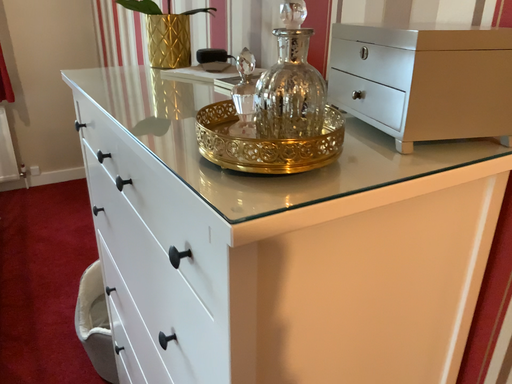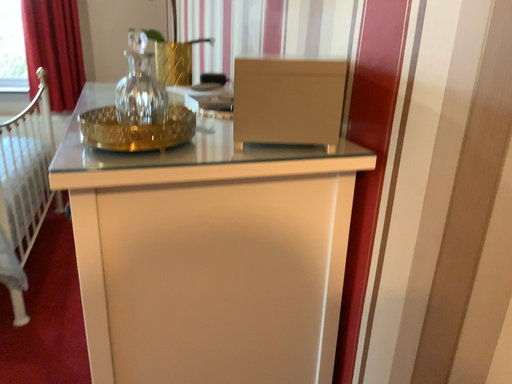
Question: Which way did the camera rotate in the video?

Choices:
 (A) rotated right
 (B) rotated left

Answer: (B)